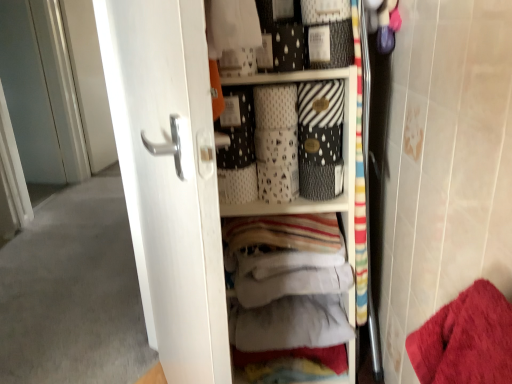
Question: In the image, is white matte baskets at upper center positioned in front of or behind white glossy door at center, the 2th screen door viewed from the left?

Choices:
 (A) behind
 (B) front

Answer: (A)

Question: Looking at the image, does white matte baskets at upper center seem bigger or smaller compared to white glossy door at center, which is the 1th screen door from right to left?

Choices:
 (A) big
 (B) small

Answer: (B)

Question: Which object is positioned closest to the white matte baskets at upper center?

Choices:
 (A) white glossy door at center, the 2th screen door viewed from the left
 (B) white glossy door at left, which is the 2th screen door in front-to-back order

Answer: (A)

Question: Which object is positioned closest to the white matte baskets at upper center?

Choices:
 (A) white glossy door at left, the second screen door from the right
 (B) white glossy door at center, the 2th screen door viewed from the left

Answer: (B)